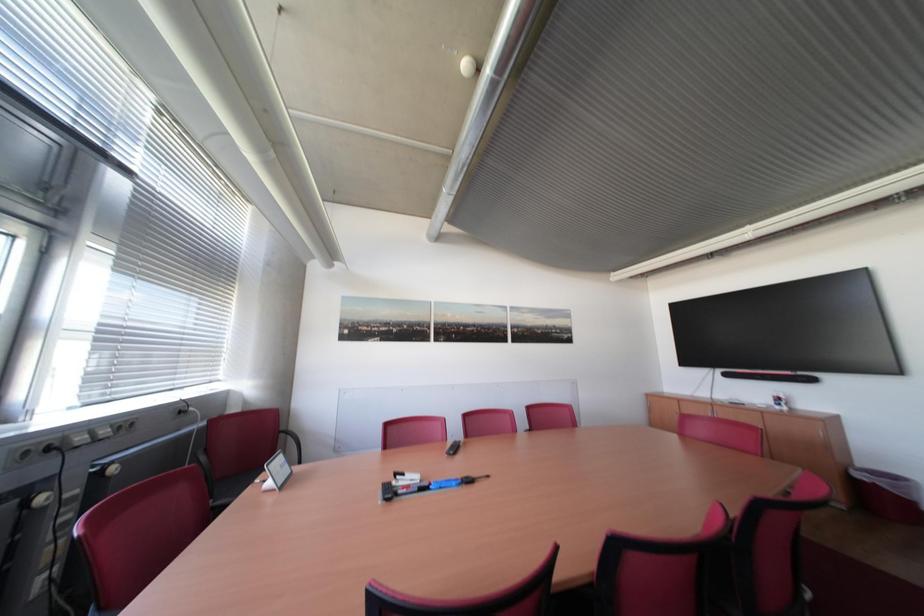
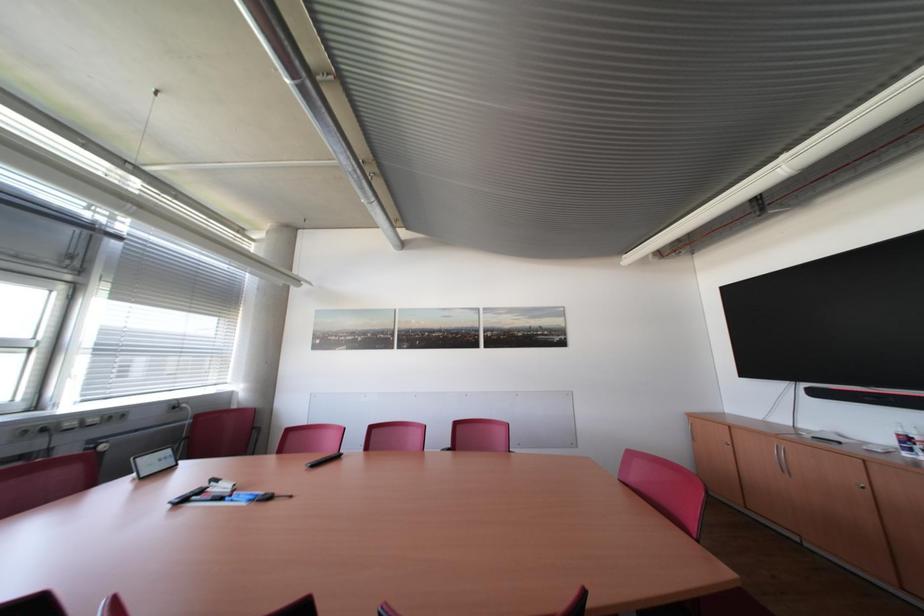
Question: In a continuous first-person perspective shot, in which direction is the camera moving?

Choices:
 (A) Left
 (B) Right
 (C) Forward
 (D) Backward

Answer: (B)